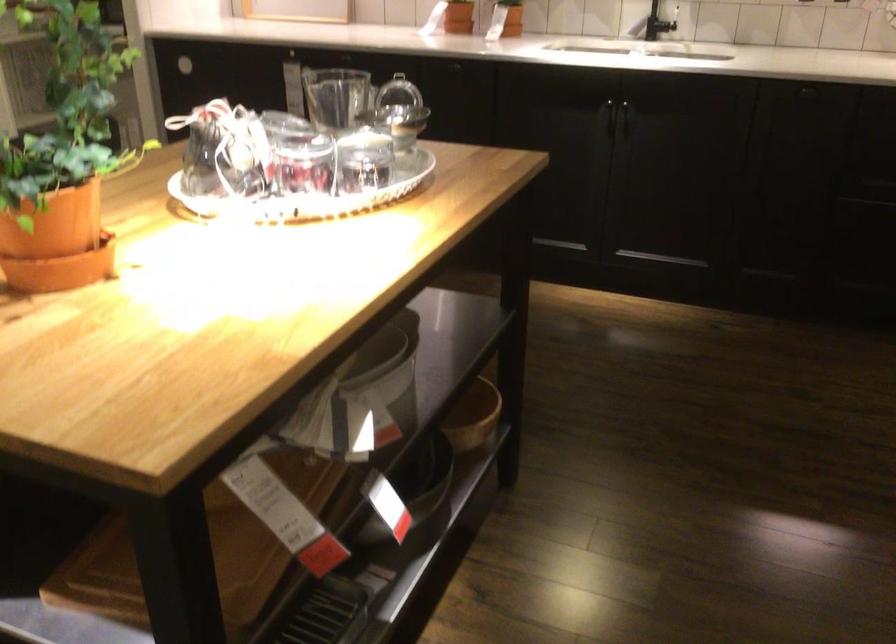
The image size is (896, 644). I want to click on dome lid handle, so click(x=398, y=71).